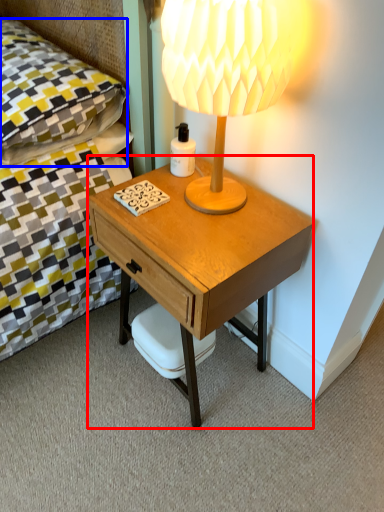
Question: Which object appears closest to the camera in this image, desk (highlighted by a red box) or pillow (highlighted by a blue box)?

Choices:
 (A) desk
 (B) pillow

Answer: (A)